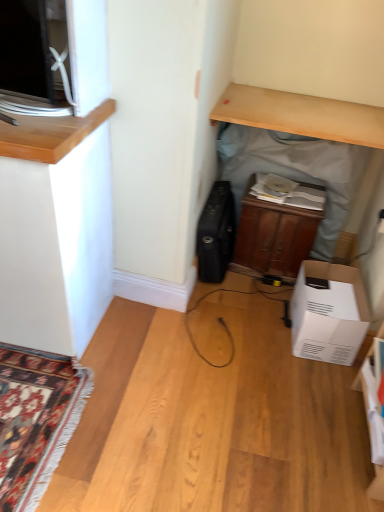
The width and height of the screenshot is (384, 512). I want to click on vacant space situated above wooden cabinet at center (from a real-world perspective), so click(288, 193).